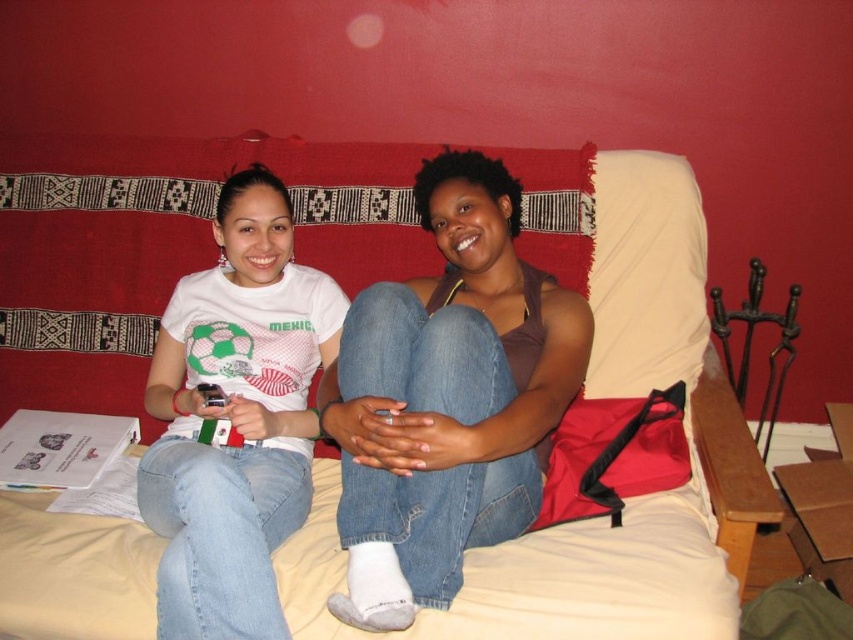
You are standing in the room and want to place a small gift on the beige fabric bed at center. The point given is point (544, 577). Is this point on the beige fabric bed at center?

Yes, the point (544, 577) is on the beige fabric bed at center according to the provided coordinates.

You are a photographer standing 1.2 meters away from the camera. You want to adjust the focus on the brown matte tank top at center. Can you reach it without moving your position?

The distance between the brown matte tank top at center and the camera is 1.13 meters. Since you are 1.2 meters away from the camera, you can extend your arm to reach the brown matte tank top at center as the total distance from you to the tank top would be 2.33 meters. However, typical arm length is about 0.7 meters, so you might need to move closer to reach it.